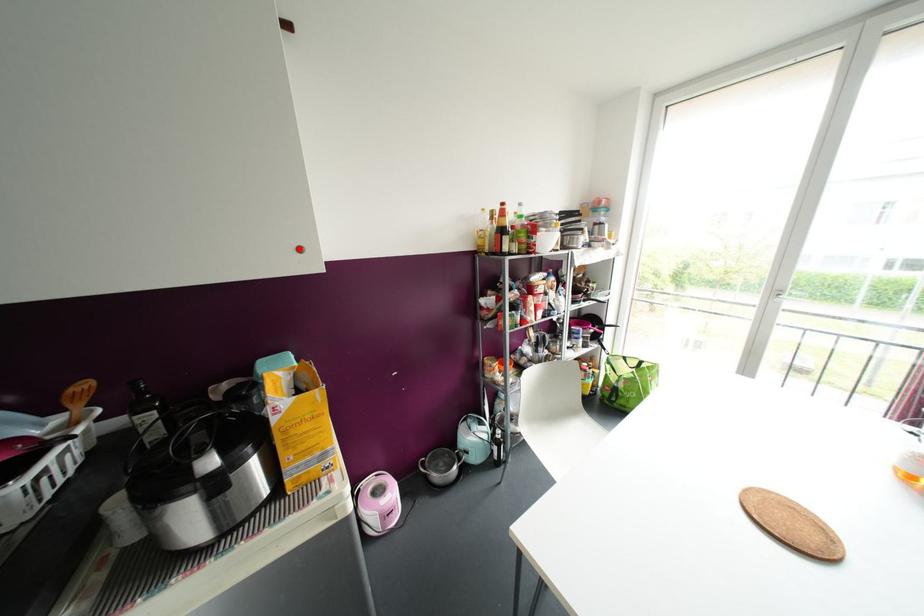
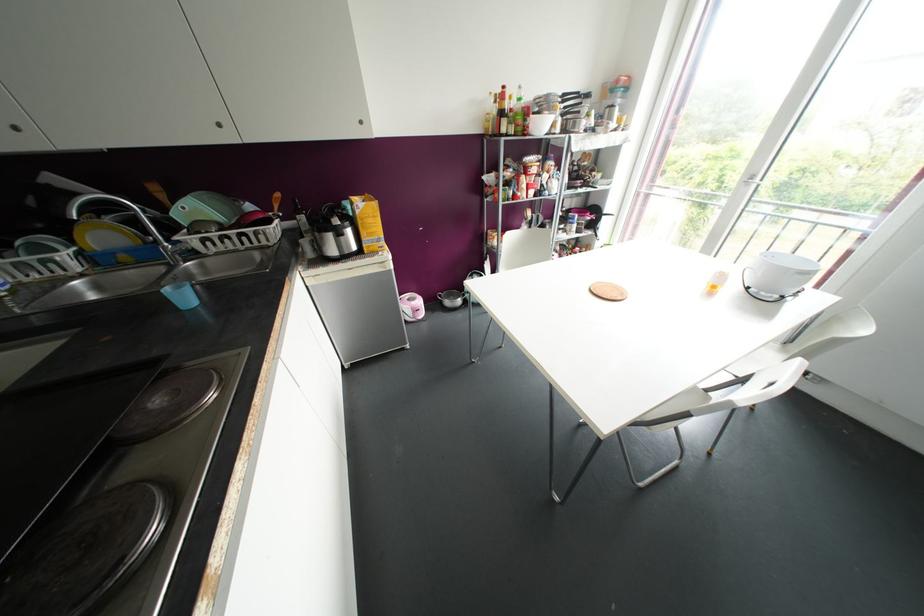
Where in the second image is the point corresponding to the highlighted location from the first image?

(360, 122)